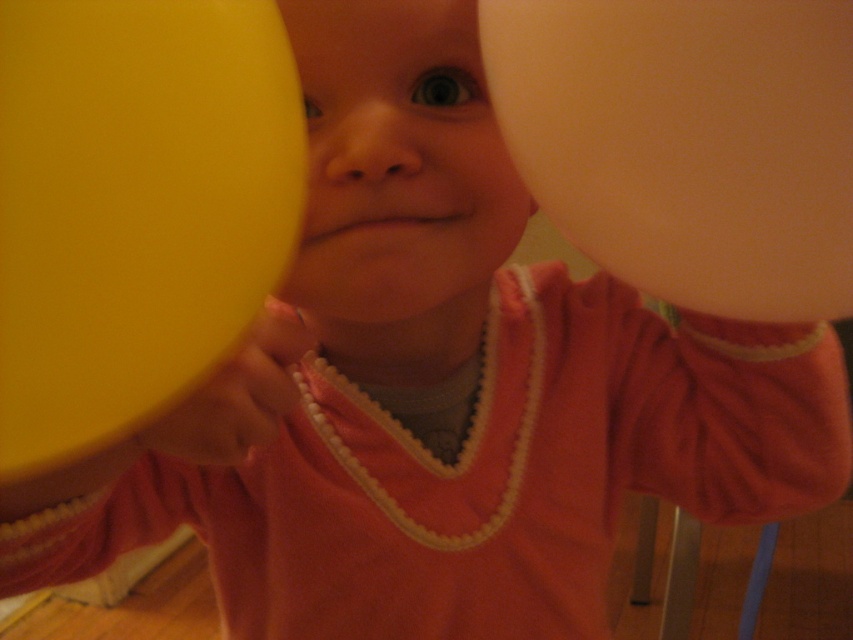
Question: Estimate the real-world distances between objects in this image. Which object is closer to the yellow rubber balloon at left?

Choices:
 (A) smooth skin face at center
 (B) matte white balloon at right

Answer: (A)

Question: Estimate the real-world distances between objects in this image. Which object is closer to the smooth skin face at center?

Choices:
 (A) matte white balloon at right
 (B) yellow rubber balloon at left

Answer: (A)

Question: Among these objects, which one is farthest from the camera?

Choices:
 (A) smooth skin face at center
 (B) matte white balloon at right
 (C) yellow rubber balloon at left

Answer: (A)

Question: Is matte white balloon at right above smooth skin face at center?

Choices:
 (A) yes
 (B) no

Answer: (B)

Question: Does yellow rubber balloon at left appear over matte white balloon at right?

Choices:
 (A) no
 (B) yes

Answer: (A)

Question: Does yellow rubber balloon at left appear under smooth skin face at center?

Choices:
 (A) yes
 (B) no

Answer: (A)